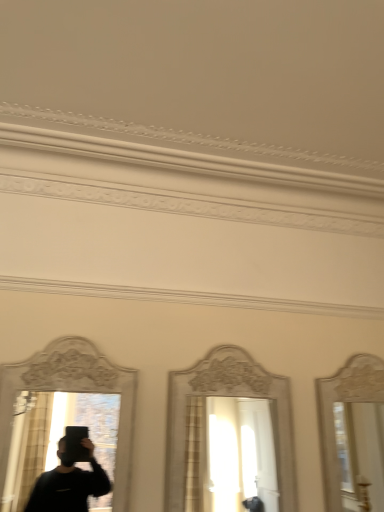
This screenshot has height=512, width=384. What are the coordinates of `white glossy mirror at center, marked as the 1th mirror in a right-to-left arrangement` in the screenshot? It's located at (206, 428).

Describe the element at coordinates (206, 428) in the screenshot. I see `white glossy mirror at center, the second mirror positioned from the left` at that location.

Measure the distance between matte white mirror at left, positioned as the 1th mirror in left-to-right order, and camera.

matte white mirror at left, positioned as the 1th mirror in left-to-right order, and camera are 1.41 meters apart from each other.

The width and height of the screenshot is (384, 512). Find the location of `matte white mirror at left, positioned as the 1th mirror in left-to-right order`. matte white mirror at left, positioned as the 1th mirror in left-to-right order is located at coordinates (65, 419).

This screenshot has height=512, width=384. What do you see at coordinates (65, 419) in the screenshot?
I see `matte white mirror at left, positioned as the 1th mirror in left-to-right order` at bounding box center [65, 419].

How much space does matte white mirror at left, which is counted as the 2th mirror, starting from the right, occupy horizontally?

6.04 centimeters.

You are a GUI agent. You are given a task and a screenshot of the screen. Output one action in this format:
    pyautogui.click(x=<x>, y=<y>)
    Task: Click on the white glossy mirror at center, the second mirror positioned from the left
    
    Given the screenshot: What is the action you would take?
    pyautogui.click(x=206, y=428)

Is white glossy mirror at center, the second mirror positioned from the left, to the right of matte white mirror at left, which is counted as the 2th mirror, starting from the right, from the viewer's perspective?

Indeed, white glossy mirror at center, the second mirror positioned from the left, is positioned on the right side of matte white mirror at left, which is counted as the 2th mirror, starting from the right.

Is the depth of white glossy mirror at center, the second mirror positioned from the left, greater than that of matte white mirror at left, which is counted as the 2th mirror, starting from the right?

That is True.

Considering the points (295, 490) and (53, 384), which point is in front, point (295, 490) or point (53, 384)?

The point (53, 384) is closer.

From the image's perspective, between white glossy mirror at center, marked as the 1th mirror in a right-to-left arrangement, and matte white mirror at left, which is counted as the 2th mirror, starting from the right, who is located below?

white glossy mirror at center, marked as the 1th mirror in a right-to-left arrangement, appears lower in the image.

From a real-world perspective, is white glossy mirror at center, marked as the 1th mirror in a right-to-left arrangement, physically located above or below matte white mirror at left, which is counted as the 2th mirror, starting from the right?

From a real-world perspective, white glossy mirror at center, marked as the 1th mirror in a right-to-left arrangement, is physically below matte white mirror at left, which is counted as the 2th mirror, starting from the right.

In the scene shown: Can you confirm if white glossy mirror at center, the second mirror positioned from the left, is thinner than matte white mirror at left, positioned as the 1th mirror in left-to-right order?

No.

Does white glossy mirror at center, the second mirror positioned from the left, have a greater height compared to matte white mirror at left, positioned as the 1th mirror in left-to-right order?

Yes, white glossy mirror at center, the second mirror positioned from the left, is taller than matte white mirror at left, positioned as the 1th mirror in left-to-right order.

Which of these two, white glossy mirror at center, marked as the 1th mirror in a right-to-left arrangement, or matte white mirror at left, positioned as the 1th mirror in left-to-right order, is bigger?

With larger size is white glossy mirror at center, marked as the 1th mirror in a right-to-left arrangement.

Can we say white glossy mirror at center, marked as the 1th mirror in a right-to-left arrangement, lies outside matte white mirror at left, positioned as the 1th mirror in left-to-right order?

Absolutely, white glossy mirror at center, marked as the 1th mirror in a right-to-left arrangement, is external to matte white mirror at left, positioned as the 1th mirror in left-to-right order.

Is white glossy mirror at center, marked as the 1th mirror in a right-to-left arrangement, in contact with matte white mirror at left, positioned as the 1th mirror in left-to-right order?

No, white glossy mirror at center, marked as the 1th mirror in a right-to-left arrangement, is not making contact with matte white mirror at left, positioned as the 1th mirror in left-to-right order.

Does white glossy mirror at center, marked as the 1th mirror in a right-to-left arrangement, turn towards matte white mirror at left, which is counted as the 2th mirror, starting from the right?

No, white glossy mirror at center, marked as the 1th mirror in a right-to-left arrangement, is not aimed at matte white mirror at left, which is counted as the 2th mirror, starting from the right.

How much distance is there between white glossy mirror at center, marked as the 1th mirror in a right-to-left arrangement, and matte white mirror at left, positioned as the 1th mirror in left-to-right order?

They are 15.59 inches apart.

This screenshot has height=512, width=384. I want to click on mirror lying on the right of matte white mirror at left, which is counted as the 2th mirror, starting from the right, so click(206, 428).

Which object is positioned more to the left, matte white mirror at left, which is counted as the 2th mirror, starting from the right, or white glossy mirror at center, marked as the 1th mirror in a right-to-left arrangement?

From the viewer's perspective, matte white mirror at left, which is counted as the 2th mirror, starting from the right, appears more on the left side.

Does matte white mirror at left, positioned as the 1th mirror in left-to-right order, lie in front of white glossy mirror at center, the second mirror positioned from the left?

Yes.

Between point (53, 416) and point (276, 428), which one is positioned in front?

Point (53, 416)

In the scene shown: From the image's perspective, is matte white mirror at left, which is counted as the 2th mirror, starting from the right, on white glossy mirror at center, the second mirror positioned from the left?

Correct, matte white mirror at left, which is counted as the 2th mirror, starting from the right, appears higher than white glossy mirror at center, the second mirror positioned from the left, in the image.

From a real-world perspective, who is located higher, matte white mirror at left, which is counted as the 2th mirror, starting from the right, or white glossy mirror at center, marked as the 1th mirror in a right-to-left arrangement?

matte white mirror at left, which is counted as the 2th mirror, starting from the right, from a real-world perspective.

From the picture: Which of these two, matte white mirror at left, positioned as the 1th mirror in left-to-right order, or white glossy mirror at center, the second mirror positioned from the left, is wider?

white glossy mirror at center, the second mirror positioned from the left, is wider.

Is matte white mirror at left, which is counted as the 2th mirror, starting from the right, taller or shorter than white glossy mirror at center, the second mirror positioned from the left?

Considering their sizes, matte white mirror at left, which is counted as the 2th mirror, starting from the right, has less height than white glossy mirror at center, the second mirror positioned from the left.

Consider the image. Who is bigger, matte white mirror at left, which is counted as the 2th mirror, starting from the right, or white glossy mirror at center, marked as the 1th mirror in a right-to-left arrangement?

white glossy mirror at center, marked as the 1th mirror in a right-to-left arrangement, is bigger.

Is matte white mirror at left, which is counted as the 2th mirror, starting from the right, located outside white glossy mirror at center, the second mirror positioned from the left?

Absolutely, matte white mirror at left, which is counted as the 2th mirror, starting from the right, is external to white glossy mirror at center, the second mirror positioned from the left.

Is matte white mirror at left, which is counted as the 2th mirror, starting from the right, not near white glossy mirror at center, marked as the 1th mirror in a right-to-left arrangement?

No, matte white mirror at left, which is counted as the 2th mirror, starting from the right, is not far away from white glossy mirror at center, marked as the 1th mirror in a right-to-left arrangement.

Is matte white mirror at left, positioned as the 1th mirror in left-to-right order, looking in the opposite direction of white glossy mirror at center, the second mirror positioned from the left?

No, matte white mirror at left, positioned as the 1th mirror in left-to-right order, is not facing away from white glossy mirror at center, the second mirror positioned from the left.

How different are the orientations of matte white mirror at left, positioned as the 1th mirror in left-to-right order, and white glossy mirror at center, marked as the 1th mirror in a right-to-left arrangement, in degrees?

There is a 0.288-degree angle between the facing directions of matte white mirror at left, positioned as the 1th mirror in left-to-right order, and white glossy mirror at center, marked as the 1th mirror in a right-to-left arrangement.

Where is `mirror above the white glossy mirror at center, marked as the 1th mirror in a right-to-left arrangement (from a real-world perspective)`? This screenshot has width=384, height=512. mirror above the white glossy mirror at center, marked as the 1th mirror in a right-to-left arrangement (from a real-world perspective) is located at coordinates (65, 419).

Find the location of a particular element. mirror above the white glossy mirror at center, marked as the 1th mirror in a right-to-left arrangement (from the image's perspective) is located at coordinates (65, 419).

At what (x,y) coordinates should I click in order to perform the action: click on mirror below the matte white mirror at left, positioned as the 1th mirror in left-to-right order (from the image's perspective). Please return your answer as a coordinate pair (x, y). Looking at the image, I should click on (206, 428).